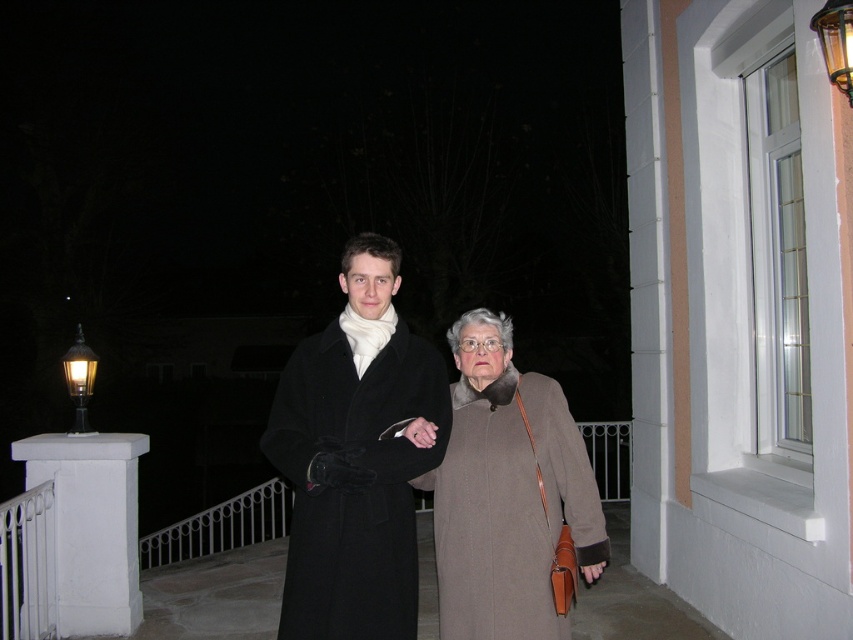
Question: Does white concrete porch at lower left appear under white painted concrete pillar at lower left?

Choices:
 (A) no
 (B) yes

Answer: (B)

Question: Can you confirm if black wool coat at center is smaller than white painted concrete pillar at lower left?

Choices:
 (A) no
 (B) yes

Answer: (B)

Question: Which object is the closest to the brown wool coat at center?

Choices:
 (A) matte black coat at center
 (B) black wool coat at center

Answer: (A)

Question: Which point is farther from the camera taking this photo?

Choices:
 (A) (518, 612)
 (B) (99, 513)
 (C) (451, 339)

Answer: (B)

Question: Which of the following is the farthest from the observer?

Choices:
 (A) (469, 611)
 (B) (383, 492)
 (C) (16, 460)
 (D) (471, 317)

Answer: (C)

Question: Does black wool coat at center appear on the left side of white concrete porch at lower left?

Choices:
 (A) no
 (B) yes

Answer: (A)